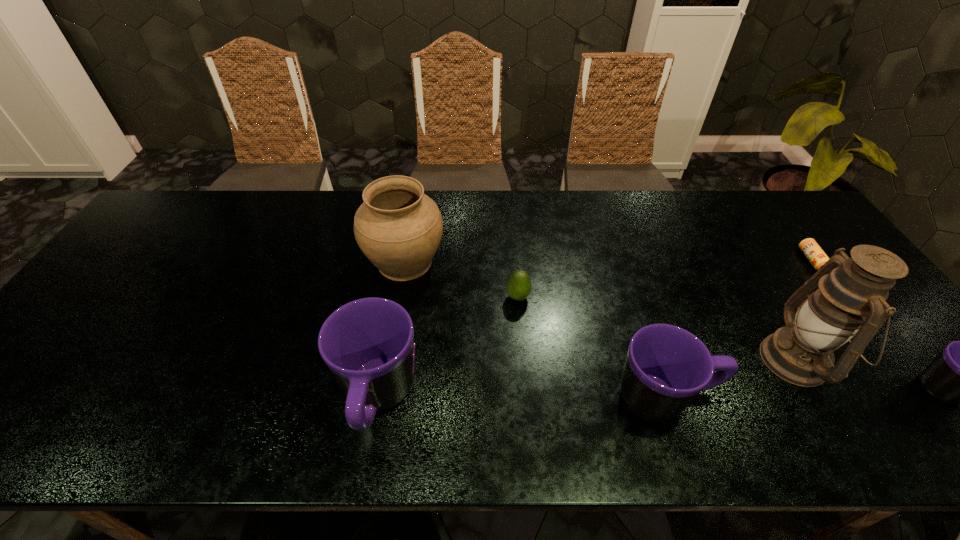
This screenshot has height=540, width=960. I want to click on the leftmost mug, so click(368, 344).

Locate an element on the screen. The image size is (960, 540). the second mug from left to right is located at coordinates (666, 367).

Locate an element on the screen. the second shortest mug is located at coordinates (666, 367).

Where is `the shortest object`? This screenshot has width=960, height=540. the shortest object is located at coordinates (817, 257).

The width and height of the screenshot is (960, 540). Find the location of `avocado`. avocado is located at coordinates (519, 285).

This screenshot has width=960, height=540. Find the location of `the second tallest object`. the second tallest object is located at coordinates (398, 228).

At what (x,y) coordinates should I click in order to perform the action: click on the tallest object. Please return your answer as a coordinate pair (x, y). Looking at the image, I should click on pyautogui.click(x=851, y=300).

The image size is (960, 540). What are the coordinates of `oil lamp` in the screenshot? It's located at (851, 300).

Locate an element on the screen. The image size is (960, 540). free spot located 0.290m with the handle on the side of the second mug from left to right is located at coordinates (843, 398).

This screenshot has height=540, width=960. Find the location of `vacant area situated on the back of the shortest object`. vacant area situated on the back of the shortest object is located at coordinates [x=758, y=190].